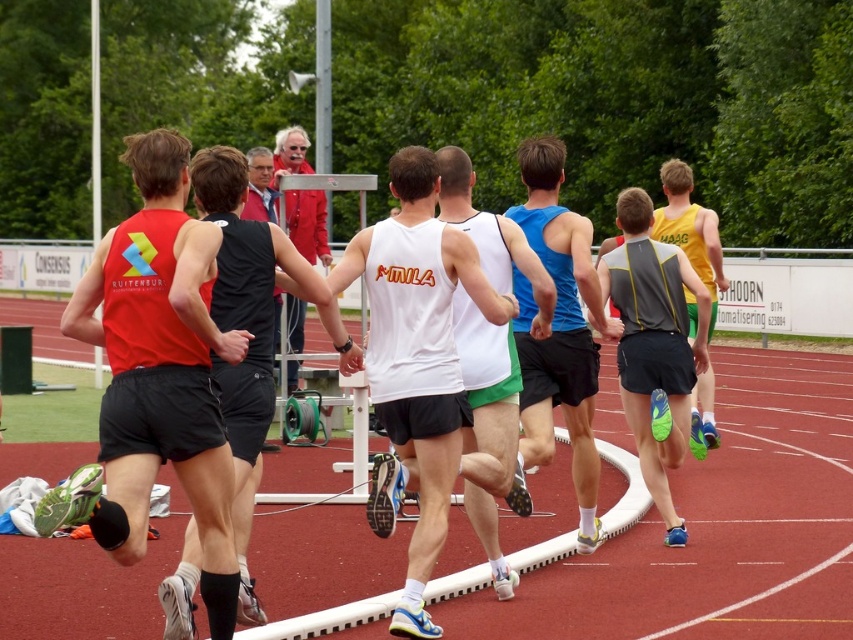
Question: Based on their relative distances, which object is farther from the red rubber track at center?

Choices:
 (A) matte red tank top at left
 (B) matte black tank top at center

Answer: (A)

Question: Is red rubber track at center bigger than white matte tank top at center?

Choices:
 (A) yes
 (B) no

Answer: (A)

Question: Which object is the farthest from the red jacket at upper center?

Choices:
 (A) blue matte tank top at center
 (B) white matte tank top at center
 (C) gray/yellow mesh vest at center
 (D) matte red tank top at left

Answer: (D)

Question: Can you confirm if red rubber track at center is thinner than blue matte tank top at center?

Choices:
 (A) yes
 (B) no

Answer: (B)

Question: Is matte red tank top at left bigger than gray/yellow mesh vest at center?

Choices:
 (A) yes
 (B) no

Answer: (B)

Question: Among these points, which one is nearest to the camera?

Choices:
 (A) (405, 385)
 (B) (173, 609)
 (C) (639, 448)

Answer: (B)